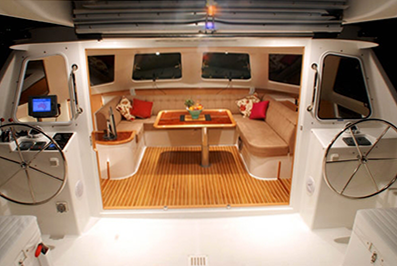
Where is `white floor`? The width and height of the screenshot is (397, 266). white floor is located at coordinates (220, 236).